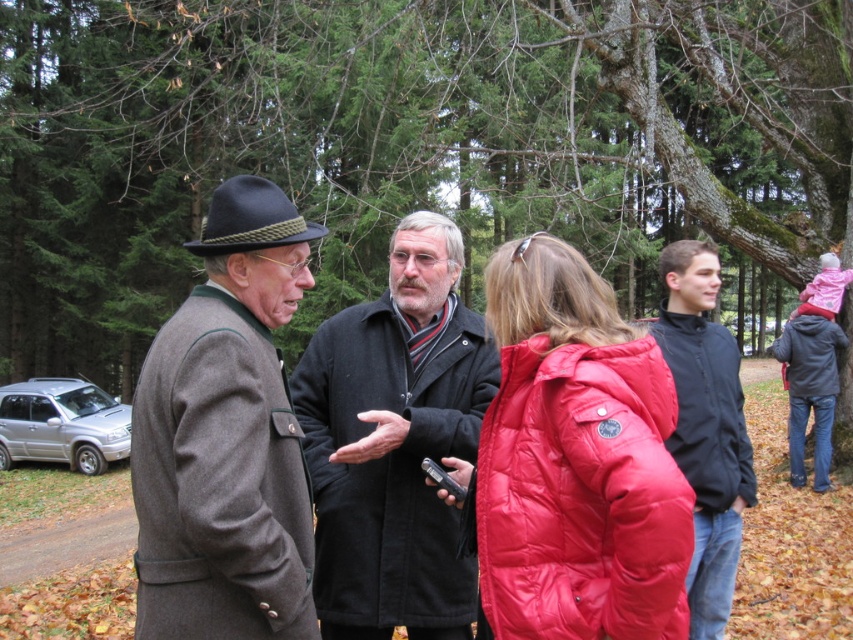
Locate an element on the screen. This screenshot has width=853, height=640. smooth bark tree at center is located at coordinates (403, 141).

You are a GUI agent. You are given a task and a screenshot of the screen. Output one action in this format:
    pyautogui.click(x=<x>, y=<y>)
    Task: Click on the smooth bark tree at center
    
    Given the screenshot: What is the action you would take?
    pyautogui.click(x=403, y=141)

Locate an element on the screen. The height and width of the screenshot is (640, 853). smooth bark tree at center is located at coordinates (403, 141).

From the picture: Does matte red puffer jacket at center have a larger size compared to black wool coat at center?

Incorrect, matte red puffer jacket at center is not larger than black wool coat at center.

Does matte red puffer jacket at center have a lesser width compared to black wool coat at center?

Yes, matte red puffer jacket at center is thinner than black wool coat at center.

Which is behind, point (515, 355) or point (424, 429)?

Positioned behind is point (424, 429).

Locate an element on the screen. matte red puffer jacket at center is located at coordinates (573, 461).

Which is behind, point (804, 353) or point (822, 332)?

Point (804, 353)

Does dark gray jacket at right have a lesser height compared to dark gray quilted jacket at right?

In fact, dark gray jacket at right may be taller than dark gray quilted jacket at right.

The height and width of the screenshot is (640, 853). What do you see at coordinates (810, 388) in the screenshot?
I see `dark gray jacket at right` at bounding box center [810, 388].

You are a GUI agent. You are given a task and a screenshot of the screen. Output one action in this format:
    pyautogui.click(x=<x>, y=<y>)
    Task: Click on the dark gray jacket at right
    
    Given the screenshot: What is the action you would take?
    (810, 388)